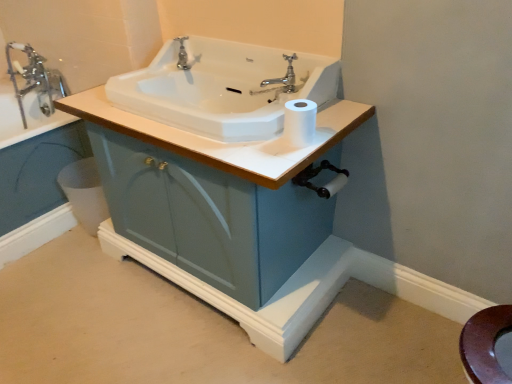
Question: Should I look upward or downward to see chrome metallic faucet at upper left, marked as the 2th tap in a front-to-back arrangement?

Choices:
 (A) down
 (B) up

Answer: (B)

Question: Is white glossy bidet at lower left closer to the viewer compared to polished chrome faucet at upper center, which ranks as the second tap in left-to-right order?

Choices:
 (A) yes
 (B) no

Answer: (B)

Question: From the image's perspective, is white glossy bidet at lower left on top of polished chrome faucet at upper center, which ranks as the second tap in left-to-right order?

Choices:
 (A) no
 (B) yes

Answer: (A)

Question: Could polished chrome faucet at upper center, acting as the first tap starting from the right, be considered to be inside white glossy bidet at lower left?

Choices:
 (A) yes
 (B) no

Answer: (B)

Question: Considering the relative sizes of white glossy bidet at lower left and polished chrome faucet at upper center, placed as the 1th tap when sorted from front to back, in the image provided, is white glossy bidet at lower left smaller than polished chrome faucet at upper center, placed as the 1th tap when sorted from front to back,?

Choices:
 (A) yes
 (B) no

Answer: (B)

Question: Is white glossy bidet at lower left taller than polished chrome faucet at upper center, which ranks as the second tap in left-to-right order?

Choices:
 (A) yes
 (B) no

Answer: (A)

Question: Is white glossy bidet at lower left oriented away from polished chrome faucet at upper center, acting as the first tap starting from the right?

Choices:
 (A) yes
 (B) no

Answer: (B)

Question: Is matte blue cabinet at center to the left of polished chrome faucet at upper center, which ranks as the second tap in left-to-right order, from the viewer's perspective?

Choices:
 (A) no
 (B) yes

Answer: (A)

Question: Is matte blue cabinet at center thinner than polished chrome faucet at upper center, which is the 2th tap from back to front?

Choices:
 (A) no
 (B) yes

Answer: (A)

Question: Is matte blue cabinet at center not near polished chrome faucet at upper center, acting as the first tap starting from the right?

Choices:
 (A) yes
 (B) no

Answer: (B)

Question: Can you confirm if matte blue cabinet at center is shorter than polished chrome faucet at upper center, which ranks as the second tap in left-to-right order?

Choices:
 (A) no
 (B) yes

Answer: (A)

Question: Does matte blue cabinet at center have a greater height compared to polished chrome faucet at upper center, acting as the first tap starting from the right?

Choices:
 (A) no
 (B) yes

Answer: (B)

Question: From the image's perspective, is matte blue cabinet at center under polished chrome faucet at upper center, which ranks as the second tap in left-to-right order?

Choices:
 (A) no
 (B) yes

Answer: (B)

Question: Can you confirm if polished chrome faucet at upper center, which ranks as the second tap in left-to-right order, is positioned to the left of chrome metallic faucet at upper left, the 1th tap viewed from the left?

Choices:
 (A) yes
 (B) no

Answer: (B)